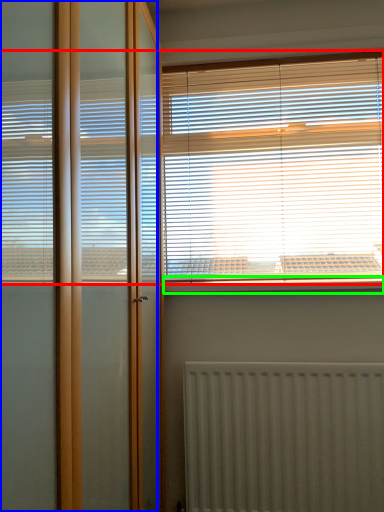
Question: Which object is positioned closest to window blind (highlighted by a red box)? Select from screen door (highlighted by a blue box) and window sill (highlighted by a green box).

Choices:
 (A) screen door
 (B) window sill

Answer: (B)